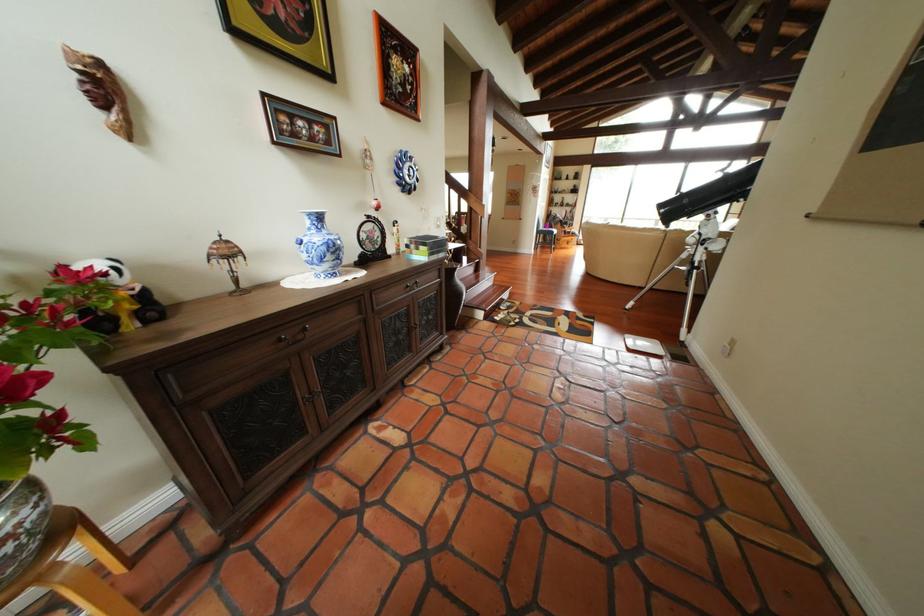
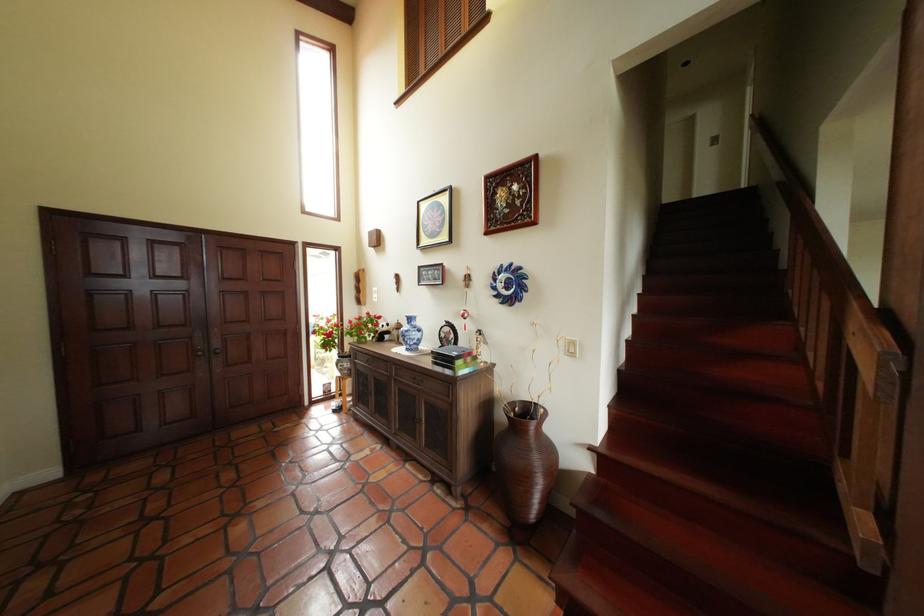
Where in the second image is the point corresponding to (x=353, y=252) from the first image?

(418, 338)